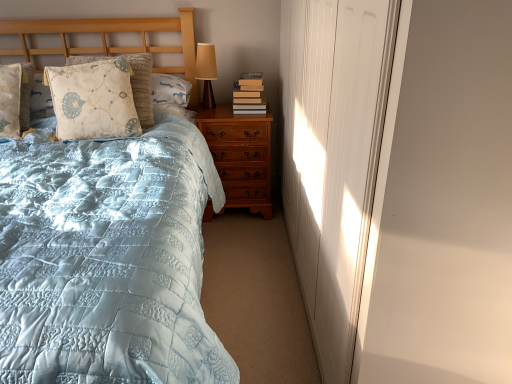
Question: Is floral-patterned fabric pillow at upper left, which is the first pillow from right to left, smaller than light blue quilted bed at left?

Choices:
 (A) yes
 (B) no

Answer: (A)

Question: Is floral-patterned fabric pillow at upper left, which is the first pillow from right to left, touching light blue quilted bed at left?

Choices:
 (A) no
 (B) yes

Answer: (A)

Question: Is floral-patterned fabric pillow at upper left, which is the first pillow from right to left, shorter than light blue quilted bed at left?

Choices:
 (A) no
 (B) yes

Answer: (B)

Question: Would you say floral-patterned fabric pillow at upper left, the second pillow from the left, is outside light blue quilted bed at left?

Choices:
 (A) no
 (B) yes

Answer: (A)

Question: From a real-world perspective, is floral-patterned fabric pillow at upper left, which is the first pillow from right to left, under light blue quilted bed at left?

Choices:
 (A) no
 (B) yes

Answer: (A)

Question: From a real-world perspective, relative to matte brown table lamp at upper center, is white matte door at right vertically above or below?

Choices:
 (A) below
 (B) above

Answer: (A)

Question: In the image, is white matte door at right positioned in front of or behind matte brown table lamp at upper center?

Choices:
 (A) front
 (B) behind

Answer: (A)

Question: Would you say white matte door at right is inside or outside matte brown table lamp at upper center?

Choices:
 (A) outside
 (B) inside

Answer: (A)

Question: From the image's perspective, is white matte door at right positioned above or below matte brown table lamp at upper center?

Choices:
 (A) below
 (B) above

Answer: (A)

Question: Is point (81, 223) closer or farther from the camera than point (78, 69)?

Choices:
 (A) farther
 (B) closer

Answer: (B)

Question: In terms of width, does light blue quilted bed at left look wider or thinner when compared to floral-patterned fabric pillow at upper left, the second pillow from the left?

Choices:
 (A) wide
 (B) thin

Answer: (A)

Question: Do you think light blue quilted bed at left is within floral-patterned fabric pillow at upper left, the second pillow from the left, or outside of it?

Choices:
 (A) inside
 (B) outside

Answer: (B)

Question: From their relative heights in the image, would you say light blue quilted bed at left is taller or shorter than floral-patterned fabric pillow at upper left, the second pillow from the left?

Choices:
 (A) short
 (B) tall

Answer: (B)

Question: From the image's perspective, relative to light blue quilted bed at left, is matte brown table lamp at upper center above or below?

Choices:
 (A) above
 (B) below

Answer: (A)

Question: Is matte brown table lamp at upper center situated inside light blue quilted bed at left or outside?

Choices:
 (A) outside
 (B) inside

Answer: (B)